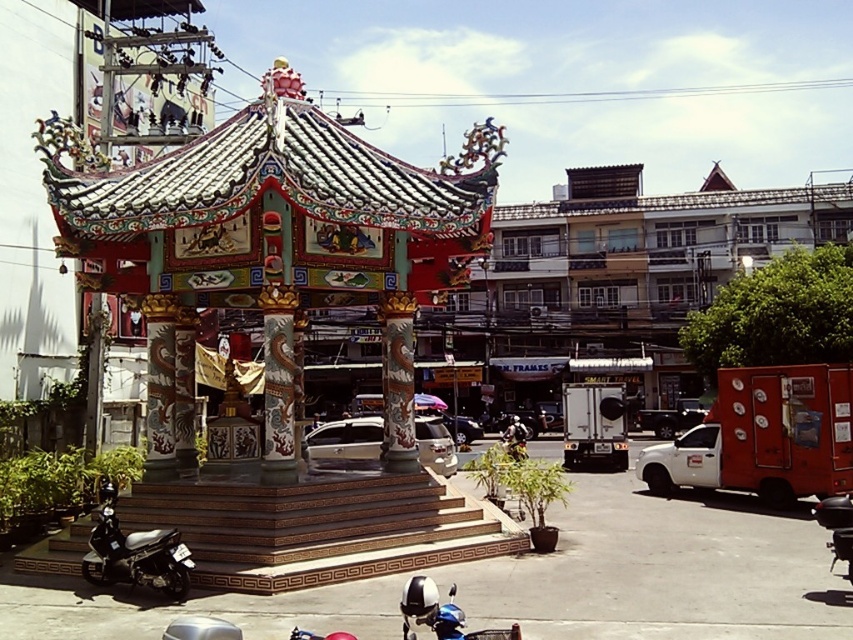
Between point (169, 580) and point (405, 637), which one is positioned in front?

Positioned in front is point (405, 637).

Does black matte motorcycle at lower left have a lesser height compared to blue metallic motorcycle at lower center?

No, black matte motorcycle at lower left is not shorter than blue metallic motorcycle at lower center.

Who is more forward, (120,566) or (492,636)?

Point (492,636) is more forward.

Where is `black matte motorcycle at lower left`? Image resolution: width=853 pixels, height=640 pixels. black matte motorcycle at lower left is located at coordinates (135, 554).

Which is above, polychrome painted gazebo at center or black matte motorcycle at lower left?

Positioned higher is polychrome painted gazebo at center.

Is point (505, 541) positioned after point (173, 586)?

Yes, it is.

Between point (486, 545) and point (131, 563), which one is positioned behind?

The point (486, 545) is more distant.

Identify the location of polychrome painted gazebo at center. (286, 326).

Who is more distant from viewer, (267, 198) or (416, 620)?

Positioned behind is point (267, 198).

Measure the distance between polychrome painted gazebo at center and blue metallic motorcycle at lower center.

polychrome painted gazebo at center is 6.73 meters from blue metallic motorcycle at lower center.

Does point (184, 262) come in front of point (494, 634)?

No, (184, 262) is further to viewer.

This screenshot has width=853, height=640. Identify the location of polychrome painted gazebo at center. (286, 326).